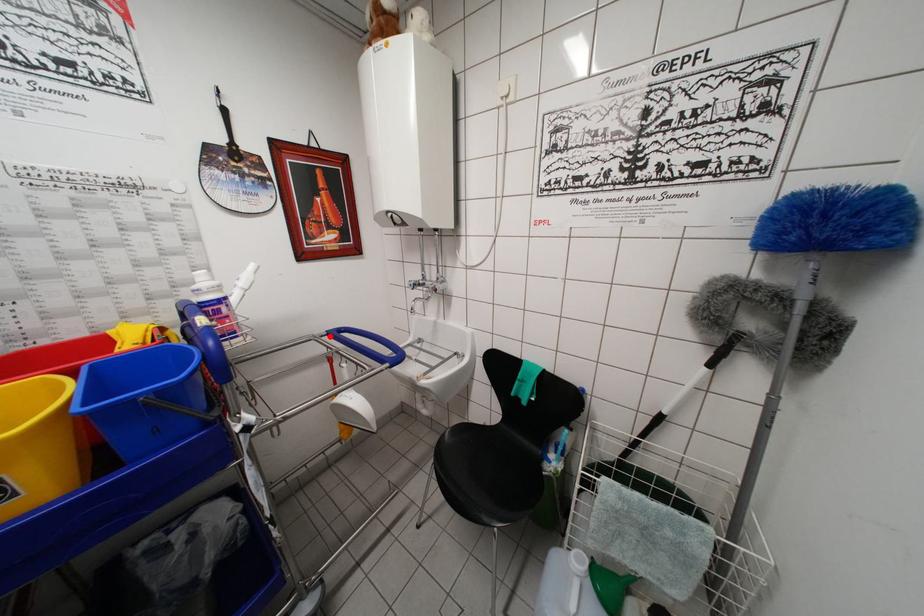
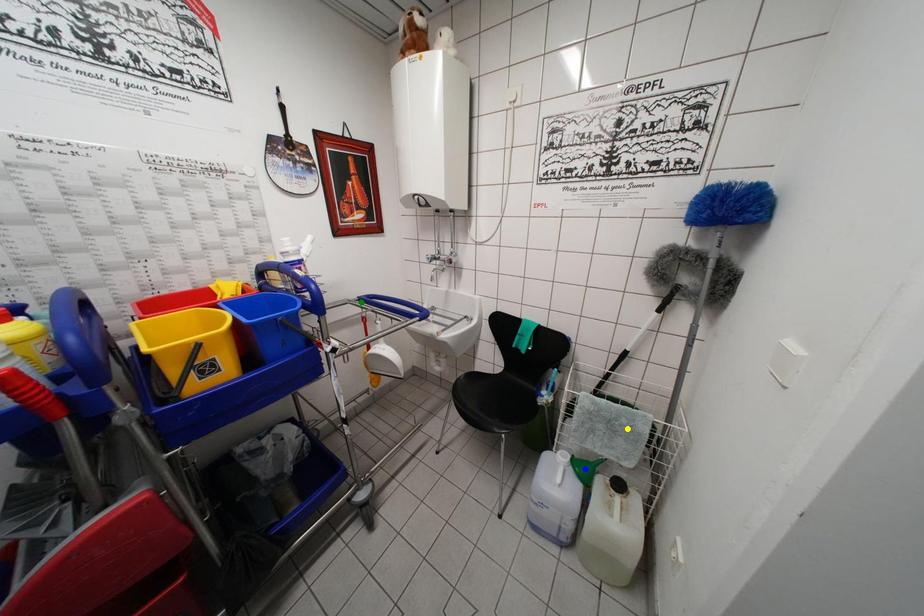
Question: I am providing you with two images of the same scene from different viewpoints. A red point is marked on the first image. You are given multiple points on the second image. Which point in image 2 represents the same 3d spot as the red point in image 1?

Choices:
 (A) blue point
 (B) green point
 (C) yellow point

Answer: (B)